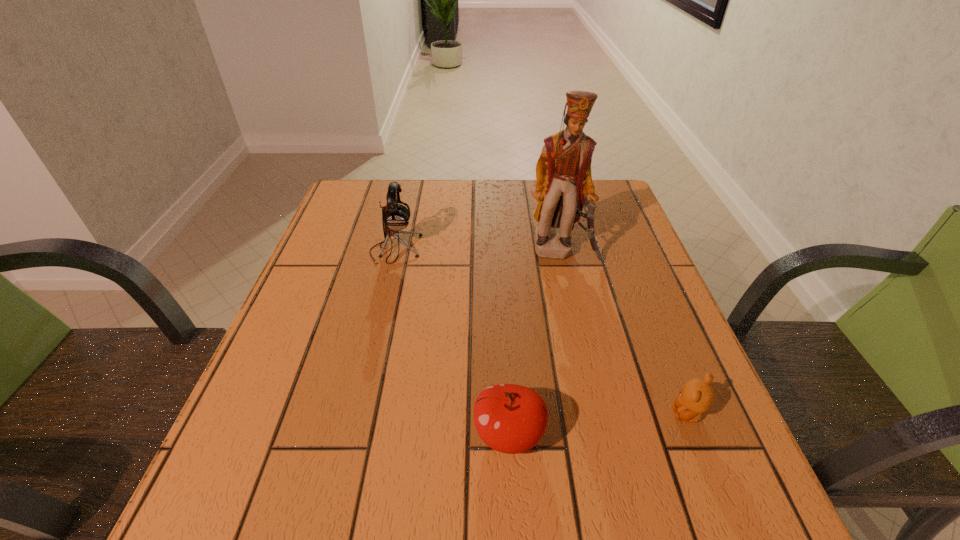
Locate an element on the screen. The width and height of the screenshot is (960, 540). the second object from right to left is located at coordinates (564, 184).

The image size is (960, 540). Find the location of `nutcracker`. nutcracker is located at coordinates (564, 184).

Identify the location of the second tallest object. The image size is (960, 540). (395, 217).

Locate an element on the screen. This screenshot has height=540, width=960. earphone is located at coordinates (395, 217).

Find the location of a particular element. This screenshot has height=540, width=960. the second shortest object is located at coordinates (509, 418).

The height and width of the screenshot is (540, 960). What are the coordinates of `the third object from right to left` in the screenshot? It's located at tap(509, 418).

The width and height of the screenshot is (960, 540). In order to click on the shortest object in this screenshot , I will do `click(697, 396)`.

Where is `the rightmost object`? The height and width of the screenshot is (540, 960). the rightmost object is located at coordinates (697, 396).

This screenshot has height=540, width=960. I want to click on vacant space located on the front-facing side of the third object from left to right, so click(x=576, y=312).

Where is `vacant space located 0.240m on the right of the earphone`? The image size is (960, 540). vacant space located 0.240m on the right of the earphone is located at coordinates (516, 249).